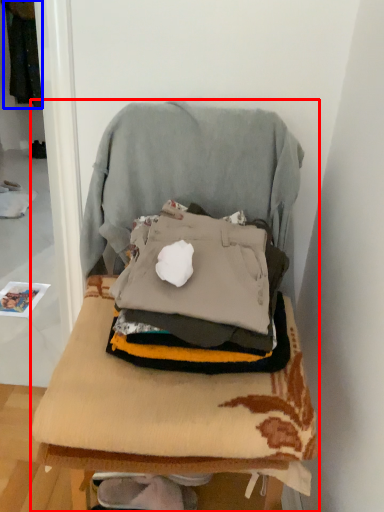
Question: Which object is closer to the camera taking this photo, furniture (highlighted by a red box) or clothing (highlighted by a blue box)?

Choices:
 (A) furniture
 (B) clothing

Answer: (A)